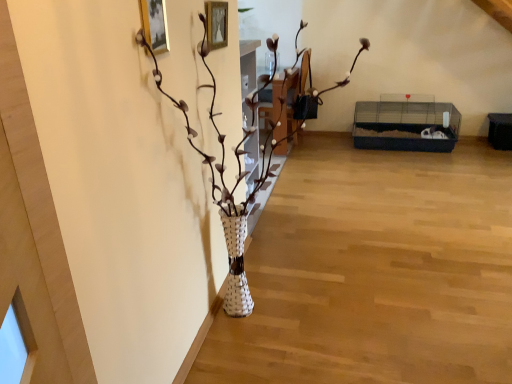
Question: Which is correct: white woven vase at center is inside metallic gold picture frame at upper left, or outside of it?

Choices:
 (A) inside
 (B) outside

Answer: (B)

Question: Considering the positions of point (239, 279) and point (152, 41), is point (239, 279) closer or farther from the camera than point (152, 41)?

Choices:
 (A) closer
 (B) farther

Answer: (B)

Question: From a real-world perspective, is white woven vase at center above or below metallic gold picture frame at upper left?

Choices:
 (A) below
 (B) above

Answer: (A)

Question: Is metallic gold picture frame at upper left in front of or behind white woven vase at center in the image?

Choices:
 (A) behind
 (B) front

Answer: (A)

Question: Does point (163, 38) appear closer or farther from the camera than point (266, 81)?

Choices:
 (A) farther
 (B) closer

Answer: (B)

Question: From the image's perspective, is metallic gold picture frame at upper left located above or below white woven vase at center?

Choices:
 (A) below
 (B) above

Answer: (B)

Question: In terms of height, does metallic gold picture frame at upper left look taller or shorter compared to white woven vase at center?

Choices:
 (A) tall
 (B) short

Answer: (B)